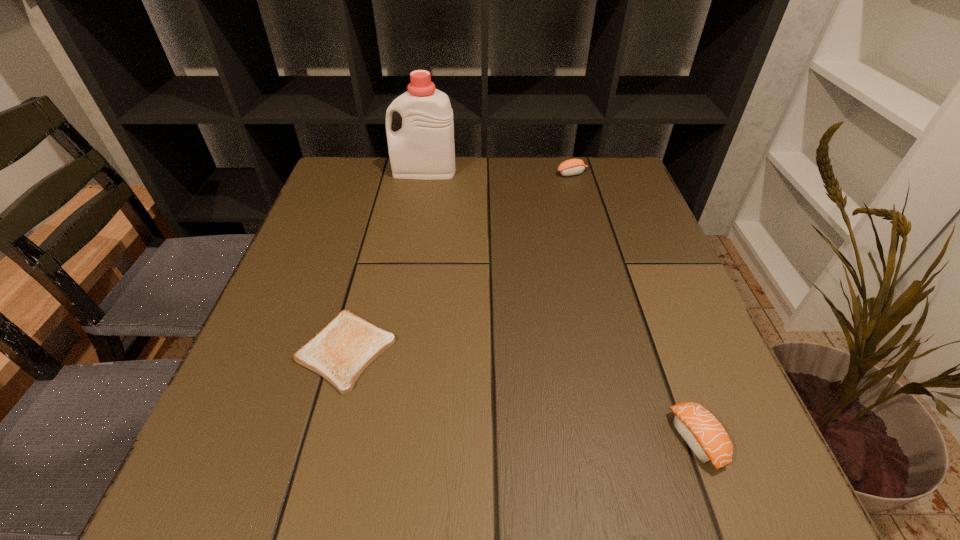
Identify the location of free space at the far right corner of the desktop. This screenshot has height=540, width=960. (623, 165).

I want to click on vacant area that lies between the nearest object and the detergent, so 561,306.

Identify the location of blank region between the second nearest object and the farther sushi. (459, 262).

What are the coordinates of `vacant area that lies between the nearest object and the detergent` in the screenshot? It's located at (561, 306).

Find the location of `free point between the nearer sushi and the farther sushi`. free point between the nearer sushi and the farther sushi is located at coordinates (635, 307).

Where is `vacant point located between the farther sushi and the tallest object`? vacant point located between the farther sushi and the tallest object is located at coordinates (498, 172).

The width and height of the screenshot is (960, 540). What are the coordinates of `blank region between the tallest object and the toast` in the screenshot? It's located at (385, 261).

Where is `vacant space that's between the nearer sushi and the farther sushi`? vacant space that's between the nearer sushi and the farther sushi is located at coordinates (635, 307).

Identify the location of vacant space that's between the tallest object and the nearest object. (561, 306).

At what (x,y) coordinates should I click in order to perform the action: click on empty location between the nearer sushi and the farther sushi. Please return your answer as a coordinate pair (x, y). This screenshot has width=960, height=540. Looking at the image, I should click on (635, 307).